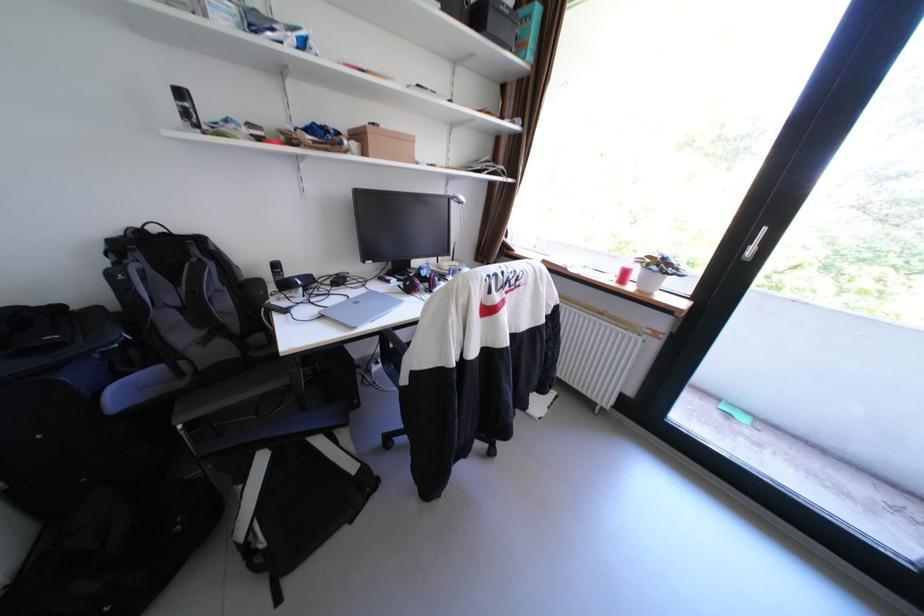
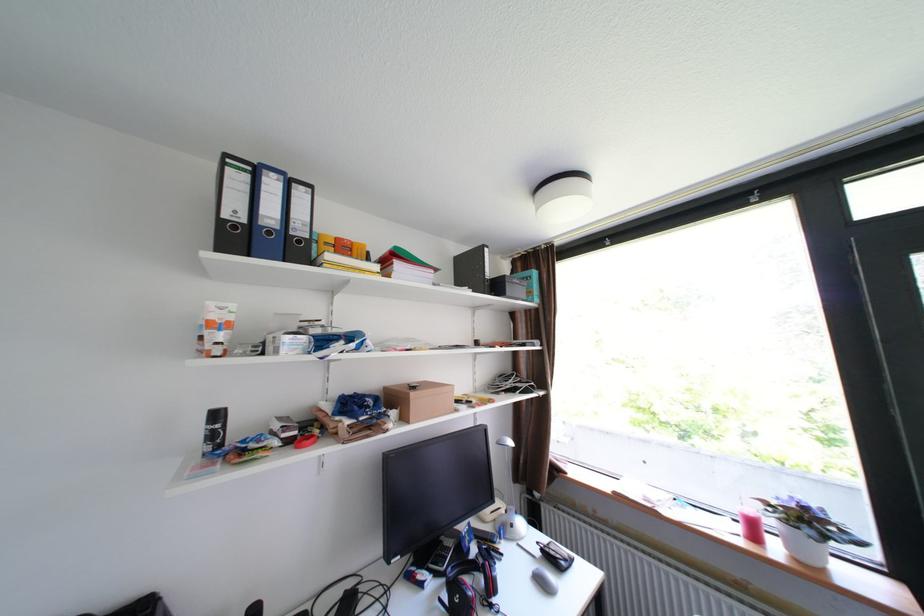
In the second image, find the point that corresponds to [409,281] in the first image.

(446, 576)